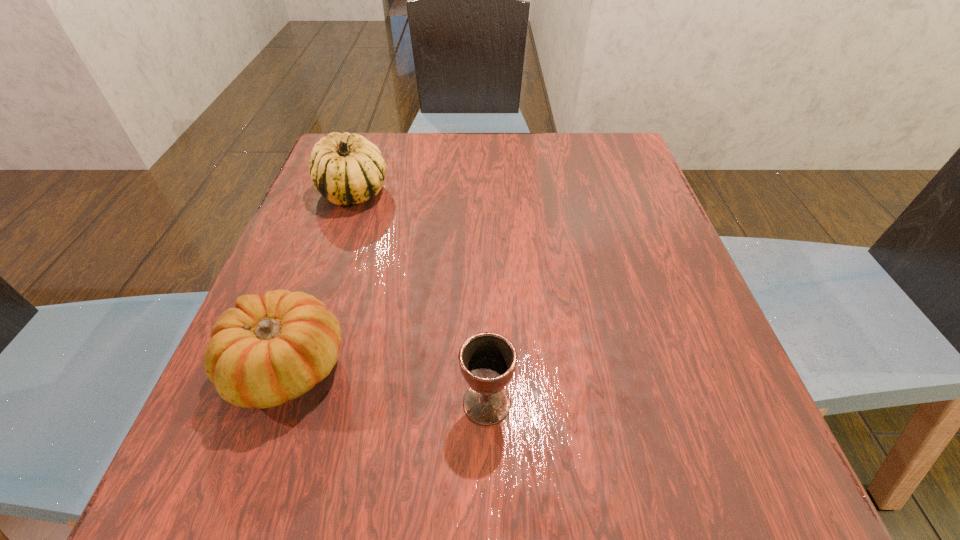
Locate an element on the screen. This screenshot has width=960, height=540. the farther gourd is located at coordinates (346, 168).

Find the location of a particular element. This screenshot has width=960, height=540. chalice is located at coordinates (487, 360).

You are a GUI agent. You are given a task and a screenshot of the screen. Output one action in this format:
    pyautogui.click(x=<x>, y=<y>)
    Task: Click on the nearer gourd
    
    Given the screenshot: What is the action you would take?
    pyautogui.click(x=269, y=349)

This screenshot has width=960, height=540. I want to click on vacant position located 0.110m on the front of the farther gourd, so click(x=333, y=249).

This screenshot has width=960, height=540. I want to click on vacant region located on the left of the chalice, so click(x=413, y=403).

Find the location of `vacant space located on the front of the nearer gourd`. vacant space located on the front of the nearer gourd is located at coordinates (240, 500).

Locate an element on the screen. Image resolution: width=960 pixels, height=540 pixels. object present at the far edge is located at coordinates (346, 168).

Locate an element on the screen. The width and height of the screenshot is (960, 540). object that is positioned at the far left corner is located at coordinates (346, 168).

Locate an element on the screen. vacant space at the far edge is located at coordinates (456, 152).

Where is `vacant space at the left edge of the desktop`? This screenshot has width=960, height=540. vacant space at the left edge of the desktop is located at coordinates (311, 221).